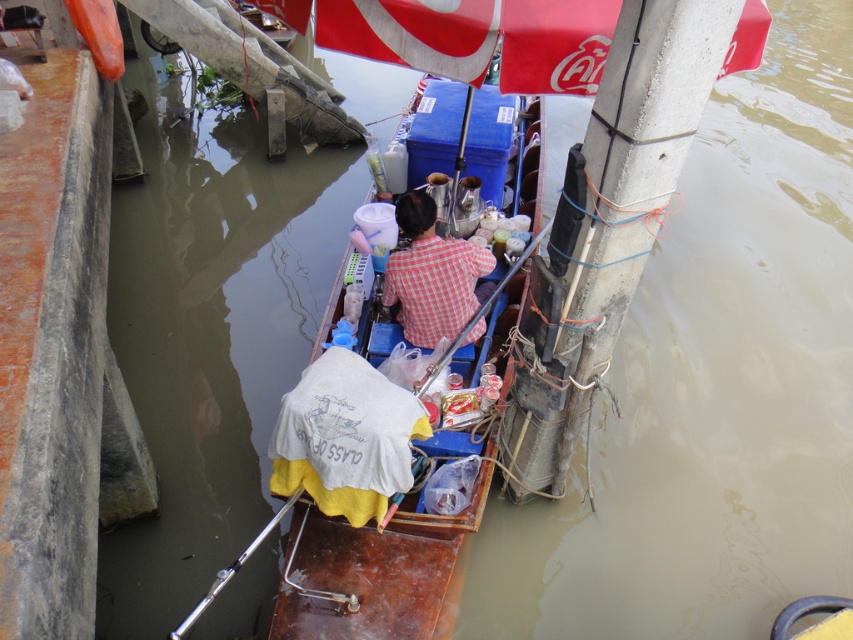
Question: Among these points, which one is farthest from the camera?

Choices:
 (A) (428, 541)
 (B) (450, 257)

Answer: (B)

Question: Which object is farther from the camera taking this photo?

Choices:
 (A) red checkered shirt at center
 (B) rusty wood boat at center

Answer: (A)

Question: Is rusty wood boat at center smaller than red checkered shirt at center?

Choices:
 (A) yes
 (B) no

Answer: (B)

Question: Which point is farther to the camera?

Choices:
 (A) rusty wood boat at center
 (B) red checkered shirt at center

Answer: (B)

Question: Can you confirm if rusty wood boat at center is positioned below red checkered shirt at center?

Choices:
 (A) no
 (B) yes

Answer: (B)

Question: Where is rusty wood boat at center located in relation to red checkered shirt at center in the image?

Choices:
 (A) above
 (B) below

Answer: (B)